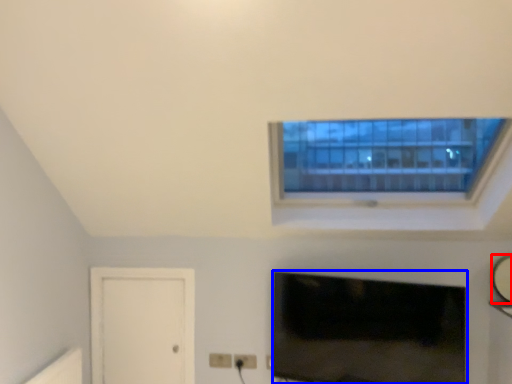
Question: Which point is closer to the camera, mirror (highlighted by a red box) or television (highlighted by a blue box)?

Choices:
 (A) mirror
 (B) television

Answer: (B)